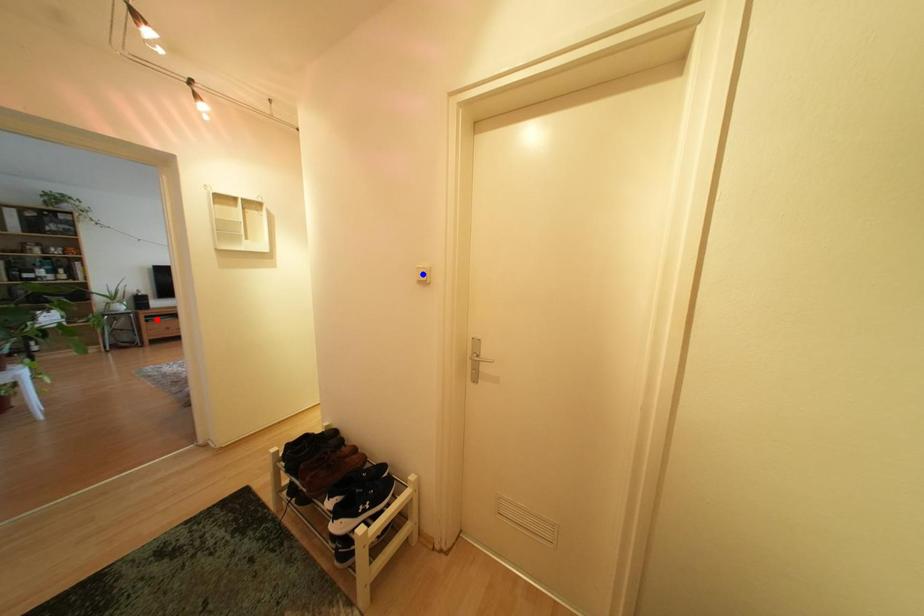
Question: Which of the two points in the image is closer to the camera?

Choices:
 (A) Blue point is closer.
 (B) Red point is closer.

Answer: (A)